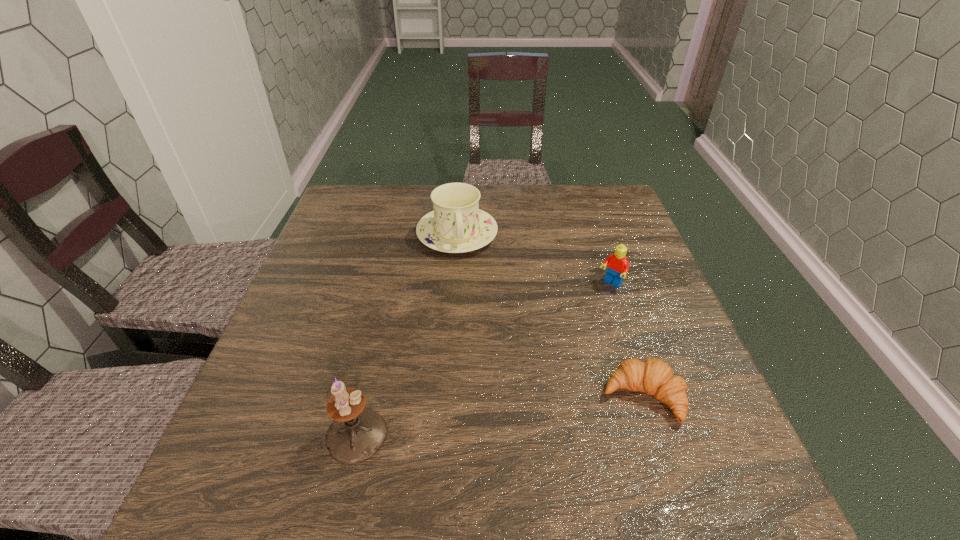
What are the coordinates of `blank region between the chinaware and the Lego` in the screenshot? It's located at (534, 259).

Where is `vacant space that's between the farthest object and the candle holder`? The width and height of the screenshot is (960, 540). vacant space that's between the farthest object and the candle holder is located at coordinates (407, 335).

Image resolution: width=960 pixels, height=540 pixels. I want to click on unoccupied position between the tallest object and the Lego, so click(x=484, y=360).

Where is `vacant point located between the chinaware and the shortest object`? The image size is (960, 540). vacant point located between the chinaware and the shortest object is located at coordinates (550, 316).

Where is `unoccupied area between the chinaware and the candle holder`? Image resolution: width=960 pixels, height=540 pixels. unoccupied area between the chinaware and the candle holder is located at coordinates click(x=407, y=335).

Locate an element on the screen. Image resolution: width=960 pixels, height=540 pixels. object that is the second closest to the farthest object is located at coordinates (653, 376).

Select which object appears as the second closest to the crescent roll. Please provide its 2D coordinates. Your answer should be formatted as a tuple, i.e. [(x, y)], where the tuple contains the x and y coordinates of a point satisfying the conditions above.

[(357, 433)]

This screenshot has height=540, width=960. What are the coordinates of `vacant space that satisfies the following two spatial constraints: 1. on the back side of the tallest object; 2. on the left side of the shortest object` in the screenshot? It's located at (366, 397).

Where is `free spot that satisfies the following two spatial constraints: 1. on the back side of the shortest object; 2. on the right side of the tallest object`? free spot that satisfies the following two spatial constraints: 1. on the back side of the shortest object; 2. on the right side of the tallest object is located at coordinates (366, 397).